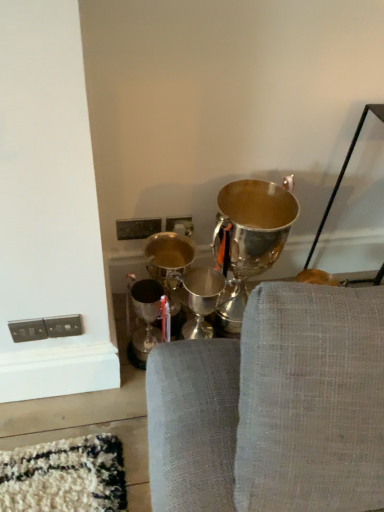
Question: Should I look upward or downward to see shiny silver trophy at center?

Choices:
 (A) up
 (B) down

Answer: (B)